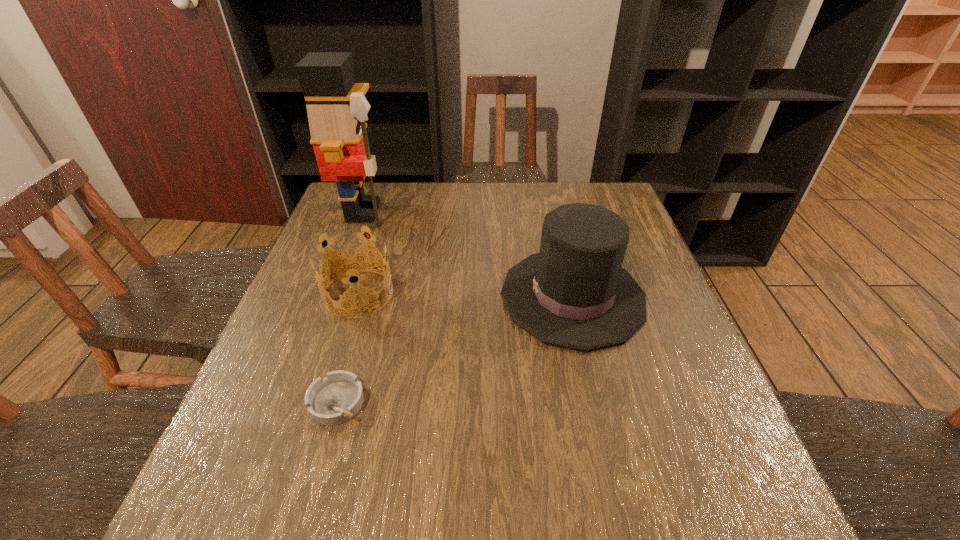
Image resolution: width=960 pixels, height=540 pixels. Find the location of `vacant area that lies between the crown and the dress hat`. vacant area that lies between the crown and the dress hat is located at coordinates (466, 295).

You are a GUI agent. You are given a task and a screenshot of the screen. Output one action in this format:
    pyautogui.click(x=<x>, y=<y>)
    Task: Click on the free space that is in between the ashtray and the dress hat
    This screenshot has width=960, height=540.
    Given the screenshot: What is the action you would take?
    pyautogui.click(x=455, y=349)

The image size is (960, 540). Find the location of `free space between the farthest object and the rightmost object`. free space between the farthest object and the rightmost object is located at coordinates (468, 254).

Select which object is the second closest to the nearest object. Please provide its 2D coordinates. Your answer should be formatted as a tuple, i.e. [(x, y)], where the tuple contains the x and y coordinates of a point satisfying the conditions above.

[(574, 293)]

This screenshot has width=960, height=540. I want to click on object that stands as the closest to the nearest object, so click(350, 263).

Locate an element on the screen. The image size is (960, 540). free spot that satisfies the following two spatial constraints: 1. in front of the tallest object holding the staff; 2. on the right side of the second shortest object is located at coordinates (334, 294).

Find the location of `free region that satisfies the following two spatial constraints: 1. in front of the nutcracker holding the staff; 2. on the left side of the nearest object`. free region that satisfies the following two spatial constraints: 1. in front of the nutcracker holding the staff; 2. on the left side of the nearest object is located at coordinates (294, 402).

Find the location of a particular element. vacant area in the image that satisfies the following two spatial constraints: 1. in front of the farthest object holding the staff; 2. on the right side of the crown is located at coordinates coord(334,294).

Find the location of a particular element. vacant space that satisfies the following two spatial constraints: 1. on the front side of the ashtray; 2. on the right side of the crown is located at coordinates (325, 402).

The height and width of the screenshot is (540, 960). I want to click on vacant space that satisfies the following two spatial constraints: 1. in front of the tallest object holding the staff; 2. on the back side of the crown, so click(x=334, y=294).